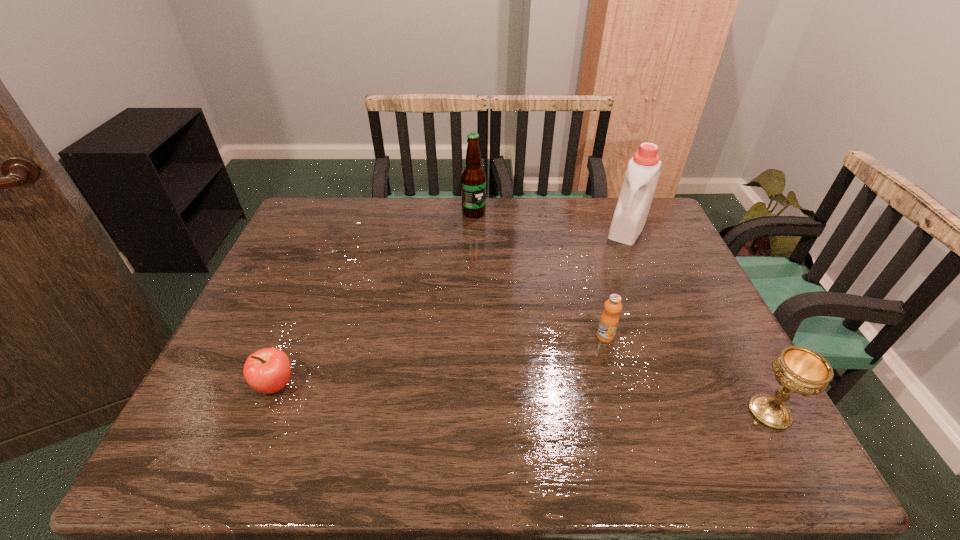
At what (x,y) coordinates should I click in order to perform the action: click on free space located on the handle side of the detergent. Please return your answer as a coordinate pair (x, y). The width and height of the screenshot is (960, 540). Looking at the image, I should click on (601, 284).

Locate an element on the screen. Image resolution: width=960 pixels, height=540 pixels. vacant region located 0.260m on the handle side of the detergent is located at coordinates click(595, 294).

The height and width of the screenshot is (540, 960). What are the coordinates of `vacant region located on the handle side of the detergent` in the screenshot? It's located at (588, 310).

Find the location of a particular element. free space located 0.200m on the front label of the third nearest object is located at coordinates (570, 403).

Locate an element on the screen. The height and width of the screenshot is (540, 960). free space located 0.120m on the front label of the third nearest object is located at coordinates (584, 377).

This screenshot has width=960, height=540. In order to click on free space located on the front label of the third nearest object in this screenshot , I will do `click(591, 362)`.

You are a GUI agent. You are given a task and a screenshot of the screen. Output one action in this format:
    pyautogui.click(x=<x>, y=<y>)
    Task: Click on the blank space located on the label of the beer bottle
    
    Given the screenshot: What is the action you would take?
    pyautogui.click(x=505, y=265)

The height and width of the screenshot is (540, 960). Identify the location of free space located on the label of the beer bottle. (511, 275).

The width and height of the screenshot is (960, 540). In order to click on vacant area situated 0.060m on the label of the beer bottle in this screenshot , I will do `click(484, 229)`.

The height and width of the screenshot is (540, 960). What are the coordinates of `detergent at the far edge` in the screenshot? It's located at (637, 191).